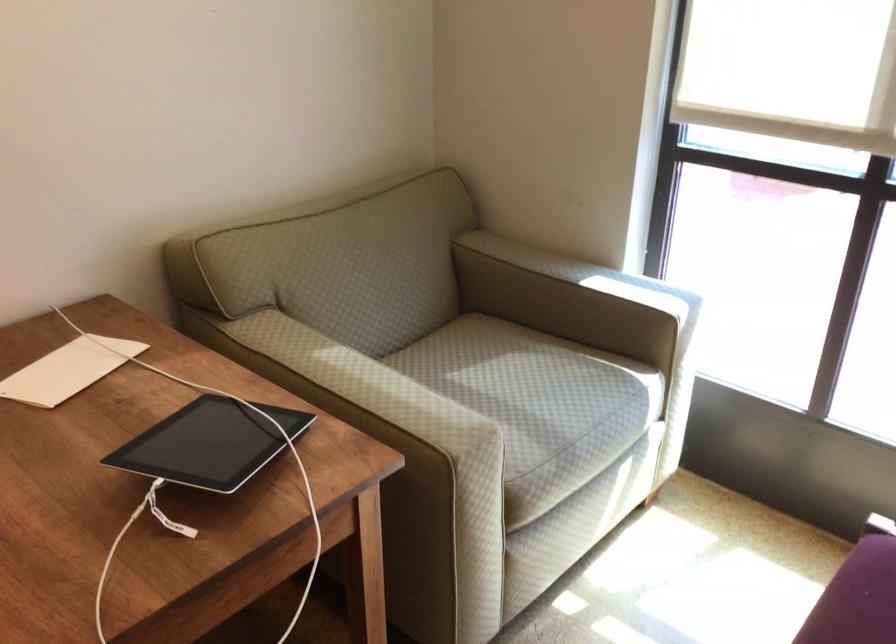
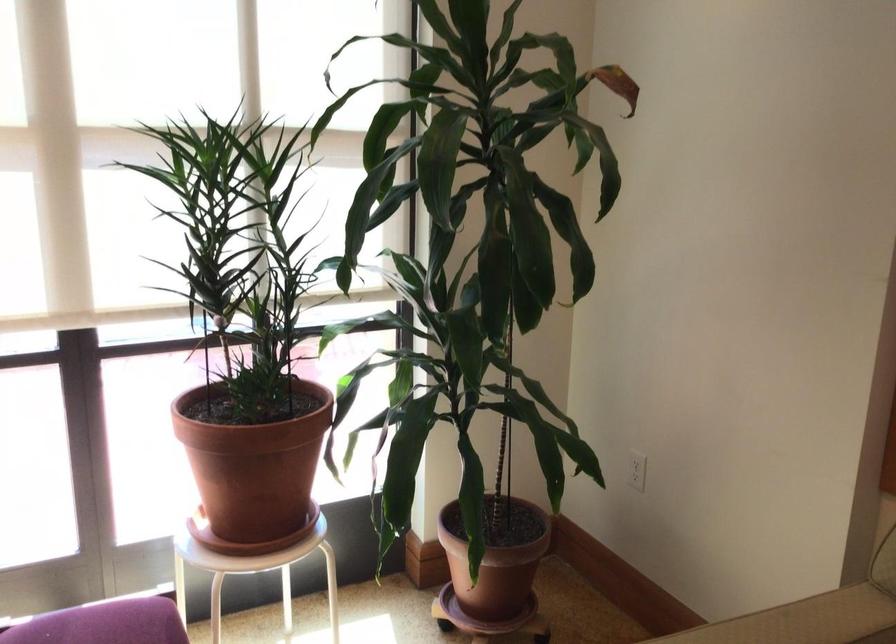
Question: The camera is either moving clockwise (left) or counter-clockwise (right) around the object. The first image is from the beginning of the video and the second image is from the end. Is the camera moving left or right when shooting the video?

Choices:
 (A) Left
 (B) Right

Answer: (A)